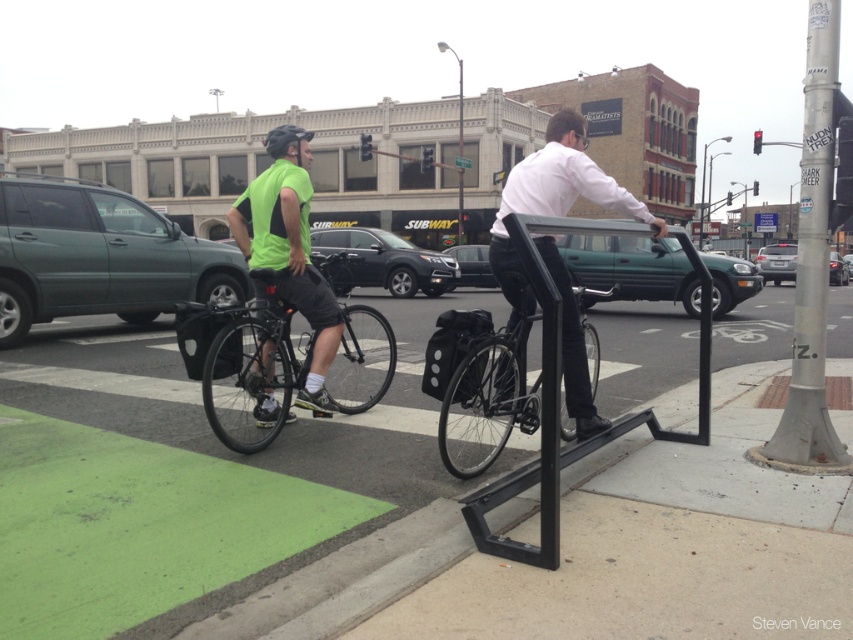
Based on the scene description, where is the silver metallic pole at right located in the image?

The silver metallic pole at right is located at point 2D coordinates of (811, 260).

You are standing at the intersection and want to cross the street to reach the green matte suv at left. The crosswalk is 5 meters away from your current position. Can you safely cross the street before the traffic light turns red in 10 seconds?

The green matte suv at left is 8.63 meters away from the viewer. Since the crosswalk is only 5 meters away, you can safely cross the street before the traffic light turns red in 10 seconds because the distance to the crosswalk is shorter than the distance to the suv, and there is enough time to reach the crosswalk within the given time.

You are a delivery driver who needs to park your green matte suv at left in a parking spot next to the silver metallic pole at right. The parking spot has a width of 2 meters. Can your suv fit into the spot?

The green matte suv at left has a smaller size compared to silver metallic pole at right. Since the pole is at the right, and the suv is smaller, it should fit into a 2 meter wide parking spot.